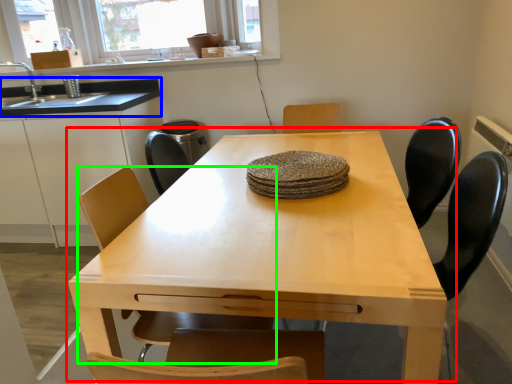
Question: Which object is the farthest from table (highlighted by a red box)? Choose among these: countertop (highlighted by a blue box) or chair (highlighted by a green box).

Choices:
 (A) countertop
 (B) chair

Answer: (A)